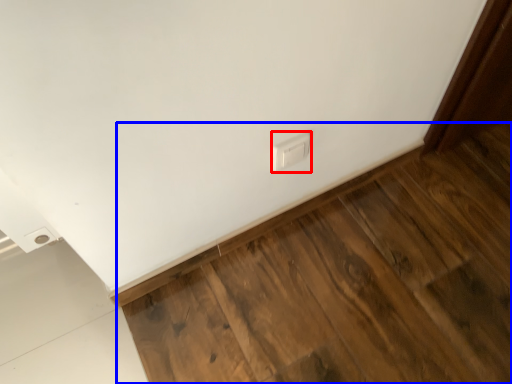
Question: Which point is closer to the camera, electric outlet (highlighted by a red box) or hardwood (highlighted by a blue box)?

Choices:
 (A) electric outlet
 (B) hardwood

Answer: (B)